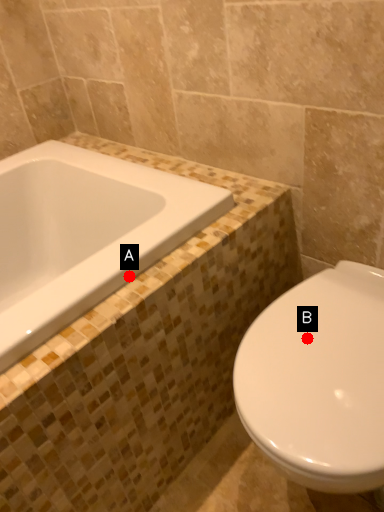
Question: Two points are circled on the image, labeled by A and B beside each circle. Which point appears farthest from the camera in this image?

Choices:
 (A) A is further
 (B) B is further

Answer: (A)